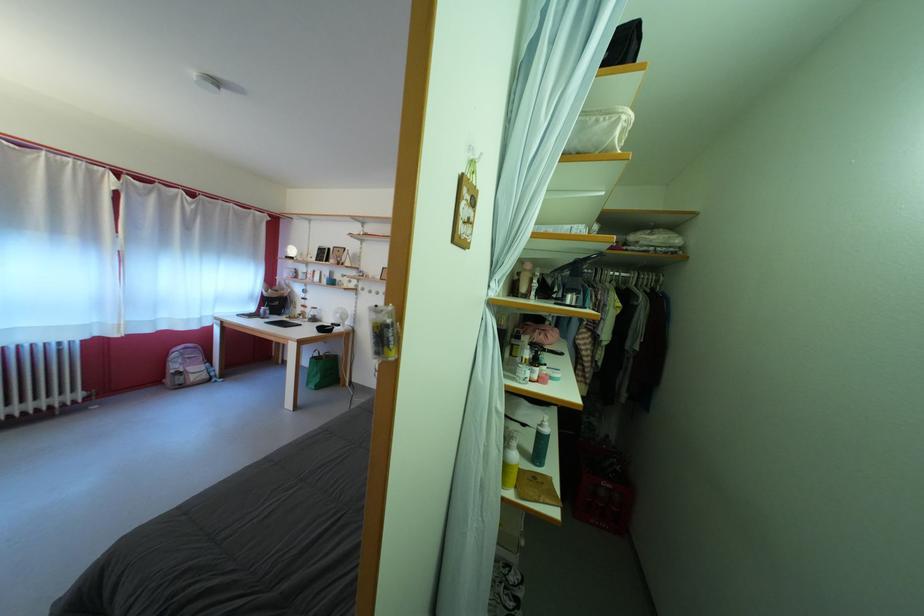
Locate an element on the screen. This screenshot has width=924, height=616. yellow spray bottle nozzle is located at coordinates (383, 331).